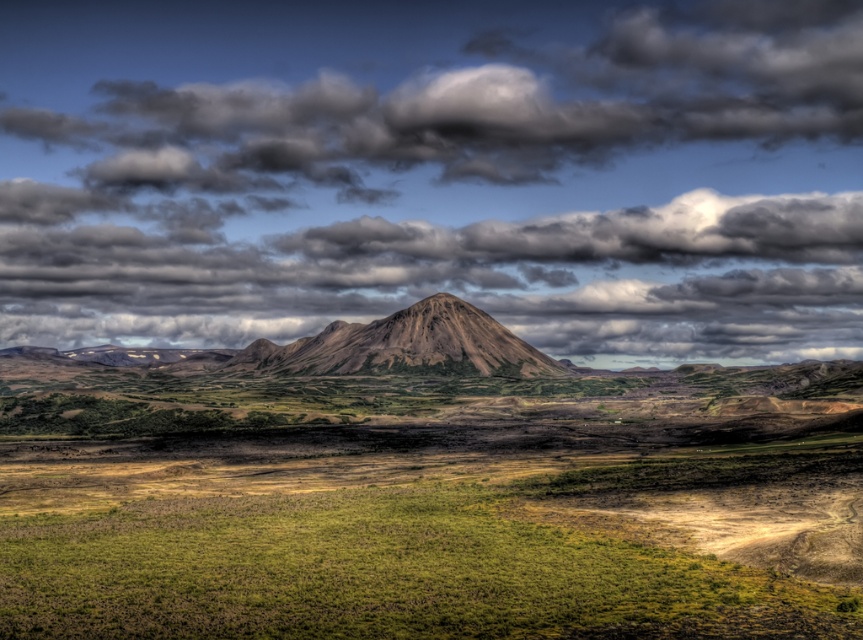
You are a hiker planning to traverse the landscape shown in the image. You need to decide whether to walk across the green grassy field at lower center or the brown textured mountain at center. Considering the width of the paths, which one is narrower and thus might be more challenging?

The green grassy field at lower center is thinner than the brown textured mountain at center, so the green grassy field at lower center is narrower and might be more challenging to traverse.

You are an airplane pilot flying over the landscape. You need to determine if the cloudy sky at upper center can provide enough space for your plane to maneuver compared to the brown textured mountain at center. Based on the scene, what should you consider?

The cloudy sky at upper center might be wider than the brown textured mountain at center, so there could be sufficient space for maneuvering. However, you should also consider the altitude and any potential weather conditions in the cloudy area before making a decision.